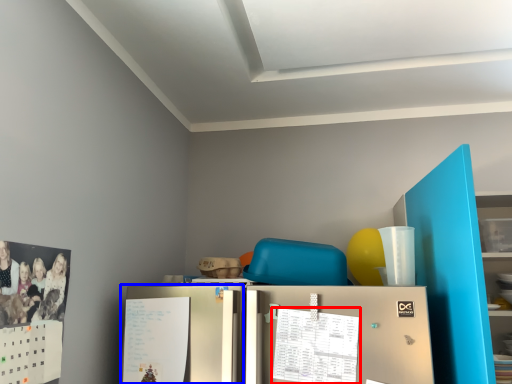
Question: Which point is further to the camera, calendar (highlighted by a red box) or fridge (highlighted by a blue box)?

Choices:
 (A) calendar
 (B) fridge

Answer: (B)